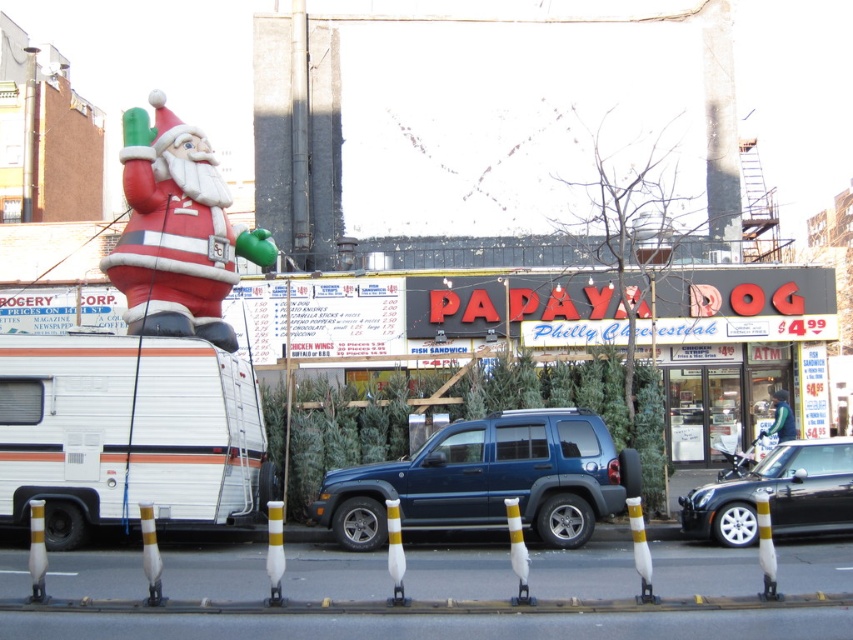
Question: Which of the following is the farthest from the observer?

Choices:
 (A) (816, 467)
 (B) (195, 152)
 (C) (103, 364)
 (D) (421, 472)

Answer: (B)

Question: Observing the image, what is the correct spatial positioning of white matte camper van at left in reference to matte plastic santa at upper left?

Choices:
 (A) below
 (B) above

Answer: (A)

Question: Is white matte camper van at left to the left of metallic blue suv at center from the viewer's perspective?

Choices:
 (A) yes
 (B) no

Answer: (A)

Question: Can you confirm if white matte camper van at left is positioned to the left of metallic blue suv at center?

Choices:
 (A) yes
 (B) no

Answer: (A)

Question: Among these points, which one is farthest from the camera?

Choices:
 (A) (216, 499)
 (B) (744, 522)
 (C) (222, 324)
 (D) (492, 445)

Answer: (C)

Question: Which of the following is the farthest from the observer?

Choices:
 (A) (780, 499)
 (B) (10, 372)
 (C) (154, 96)

Answer: (C)